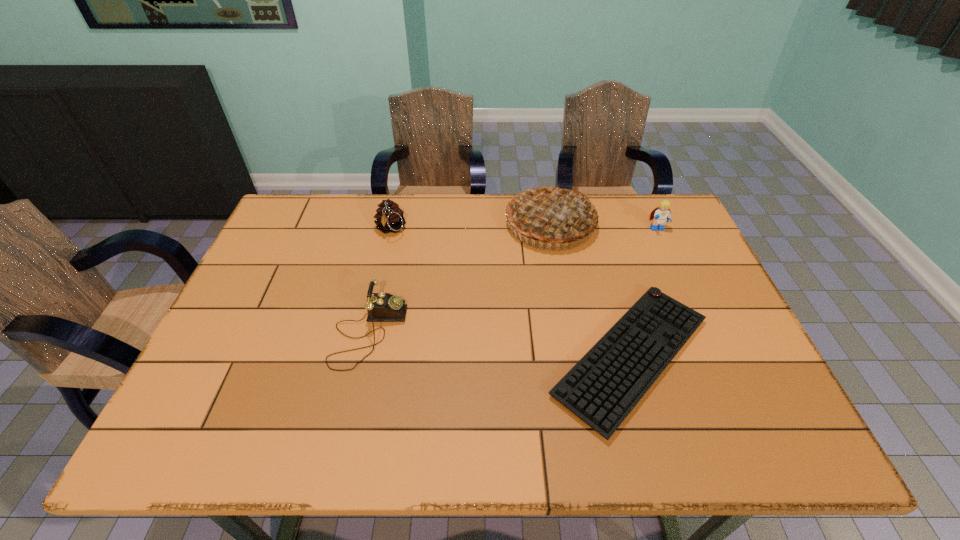
Where is `vacant space at the left edge of the desktop`? vacant space at the left edge of the desktop is located at coordinates (284, 300).

Find the location of a particular element. free location at the right edge of the desktop is located at coordinates (718, 389).

Where is `vacant space at the far left corner`? Image resolution: width=960 pixels, height=540 pixels. vacant space at the far left corner is located at coordinates point(317,215).

The height and width of the screenshot is (540, 960). In the image, there is a desktop. What are the coordinates of `vacant space at the far right corner` in the screenshot? It's located at (631, 197).

Where is `free space between the computer keyboard and the pie`? The width and height of the screenshot is (960, 540). free space between the computer keyboard and the pie is located at coordinates (590, 290).

Locate an element on the screen. vacant area between the Lego and the computer keyboard is located at coordinates (644, 293).

The width and height of the screenshot is (960, 540). Find the location of `free space between the telephone and the pinecone`. free space between the telephone and the pinecone is located at coordinates (379, 281).

At what (x,y) coordinates should I click in order to perform the action: click on empty space between the pie and the computer keyboard. Please return your answer as a coordinate pair (x, y). Looking at the image, I should click on (590, 290).

Where is `free space between the pinecone and the telephone`? free space between the pinecone and the telephone is located at coordinates (379, 281).

What are the coordinates of `vacant area that lies between the pinecone and the pie` in the screenshot? It's located at (470, 227).